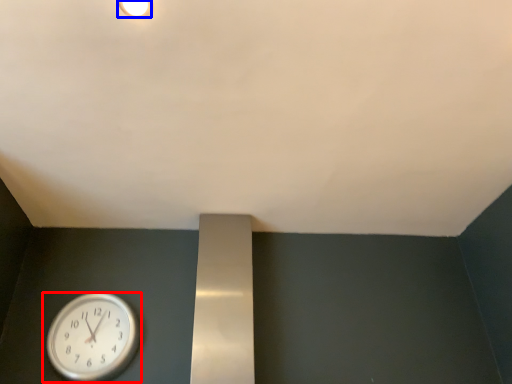
Question: Which object is closer to the camera taking this photo, wall clock (highlighted by a red box) or light fixture (highlighted by a blue box)?

Choices:
 (A) wall clock
 (B) light fixture

Answer: (B)